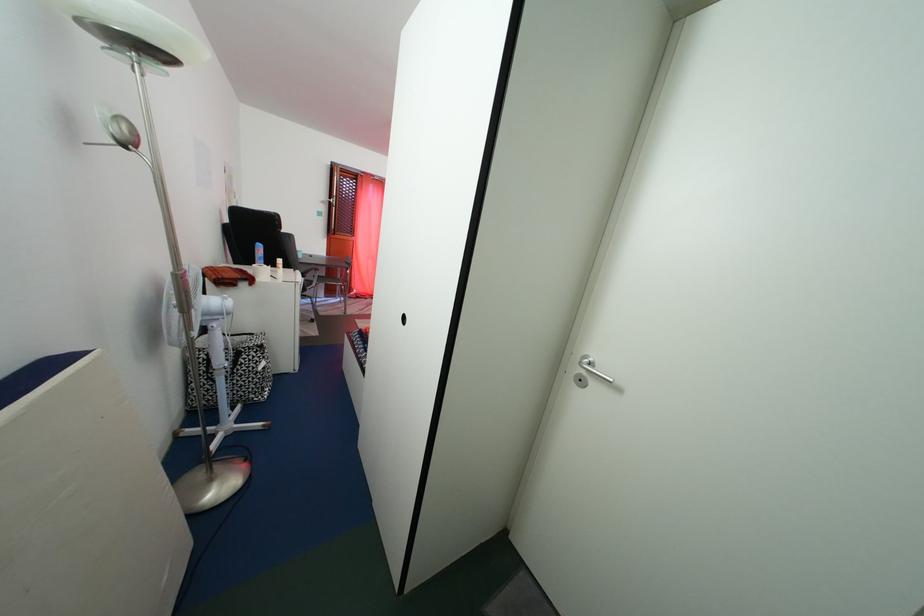
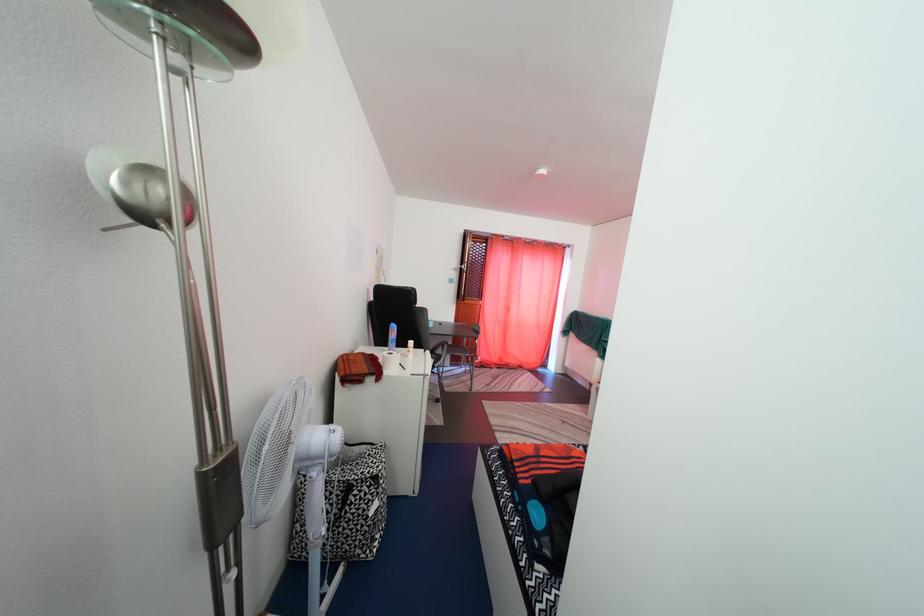
In the second image, find the point that corresponds to the point at 270,353 in the first image.

(384, 485)